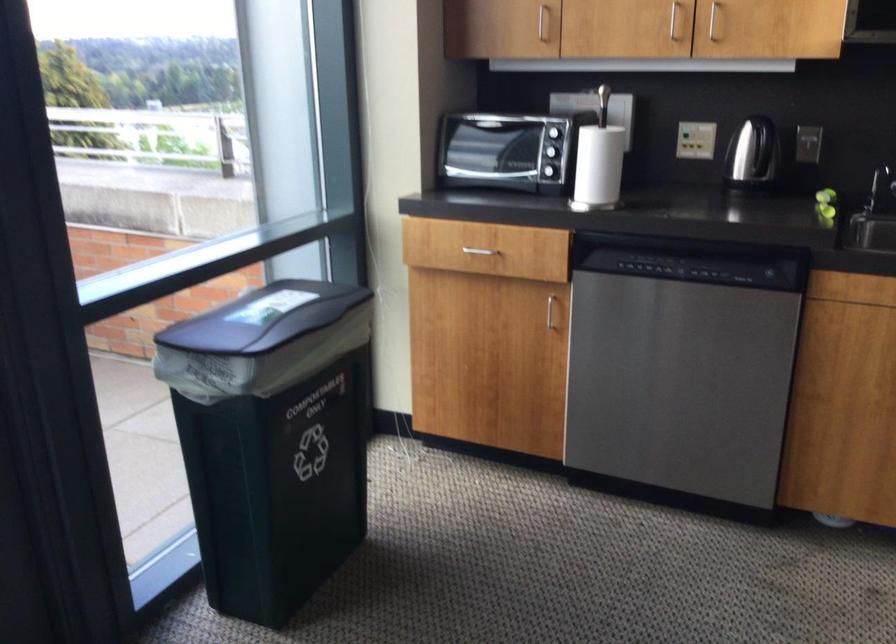
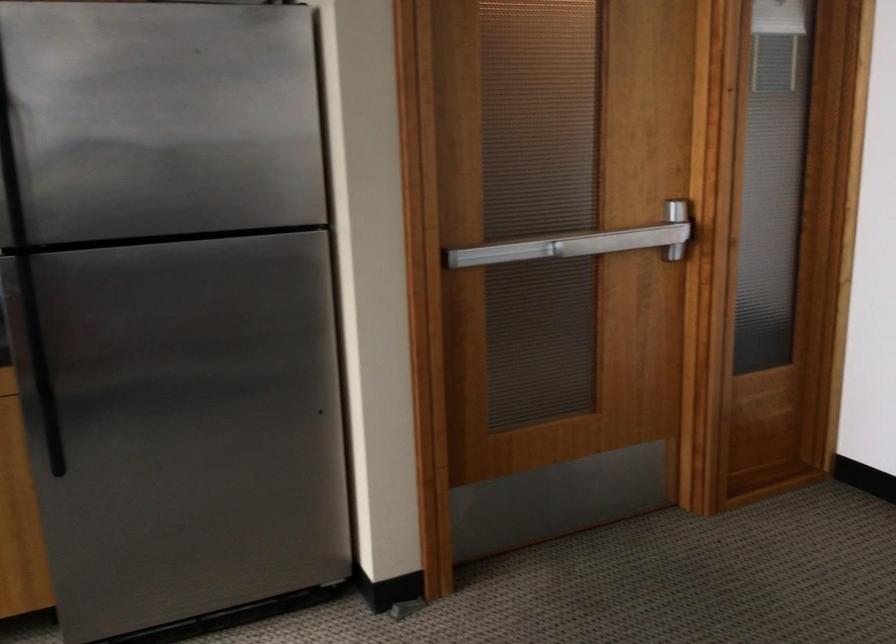
Question: The camera is either moving clockwise (left) or counter-clockwise (right) around the object. The first image is from the beginning of the video and the second image is from the end. Is the camera moving left or right when shooting the video?

Choices:
 (A) Left
 (B) Right

Answer: (A)